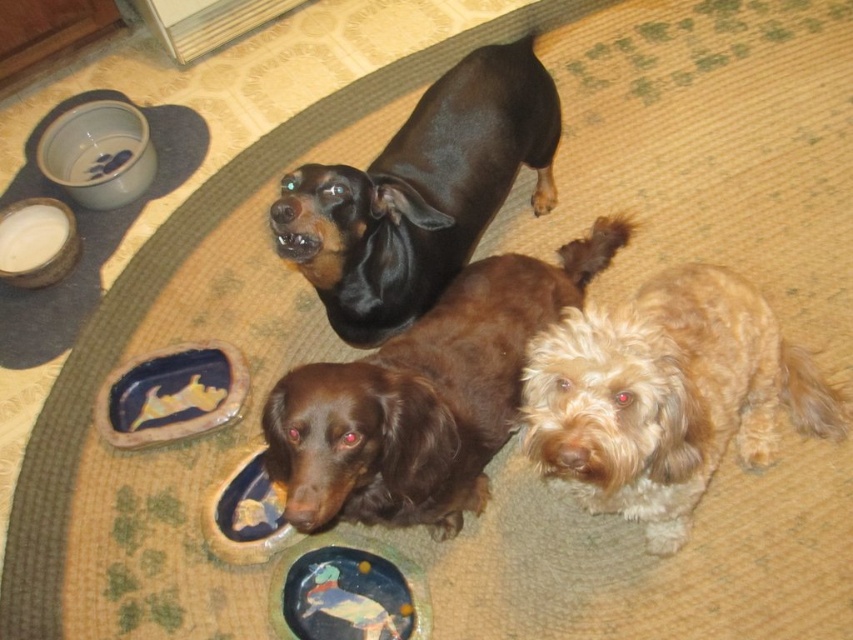
You are a dog owner who wants to place a new dog toy on the rug. The toy is the same size as the matte ceramic platter at lower center. Will the brown shaggy dog at center be able to comfortably play with the toy if placed there?

The brown shaggy dog at center is larger in size than the matte ceramic platter at lower center. Since the toy is the same size as the platter, the dog should be able to comfortably play with it as its size allows for interaction with objects of that size.

Based on the photo, where is the black shiny coat at upper center located in the image?

The black shiny coat at upper center is located at point (421, 193) in the image.

You are a toy that is 30 centimeters wide. You want to place yourself between the fuzzy light brown dog at lower right and the brown shaggy dog at center. Can you fit there without overlapping either dog?

The distance between the fuzzy light brown dog at lower right and the brown shaggy dog at center is 25.99 centimeters. Since the toy is 30 centimeters wide, it cannot fit in the space between them without overlapping the dogs.